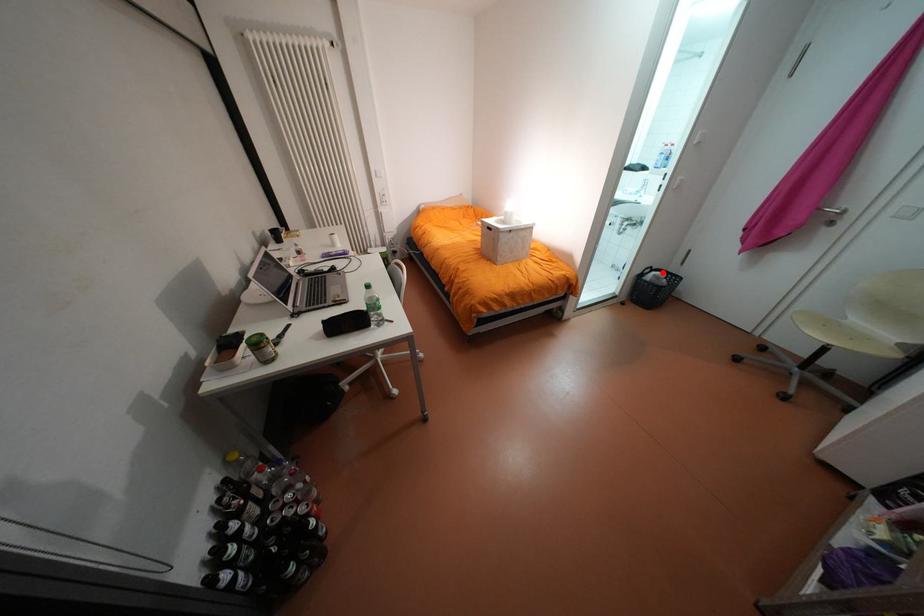
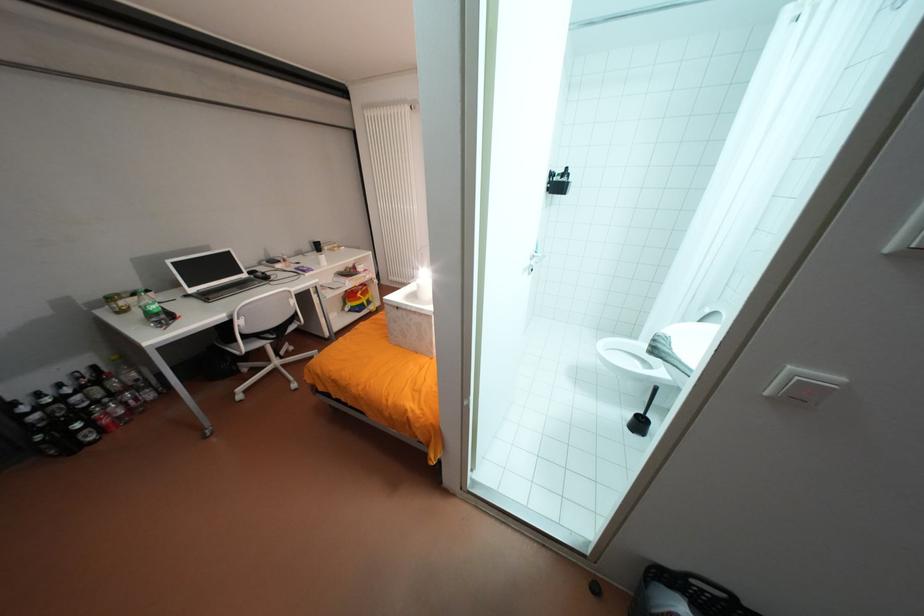
The point at the highlighted location is marked in the first image. Where is the corresponding point in the second image?

(694, 609)